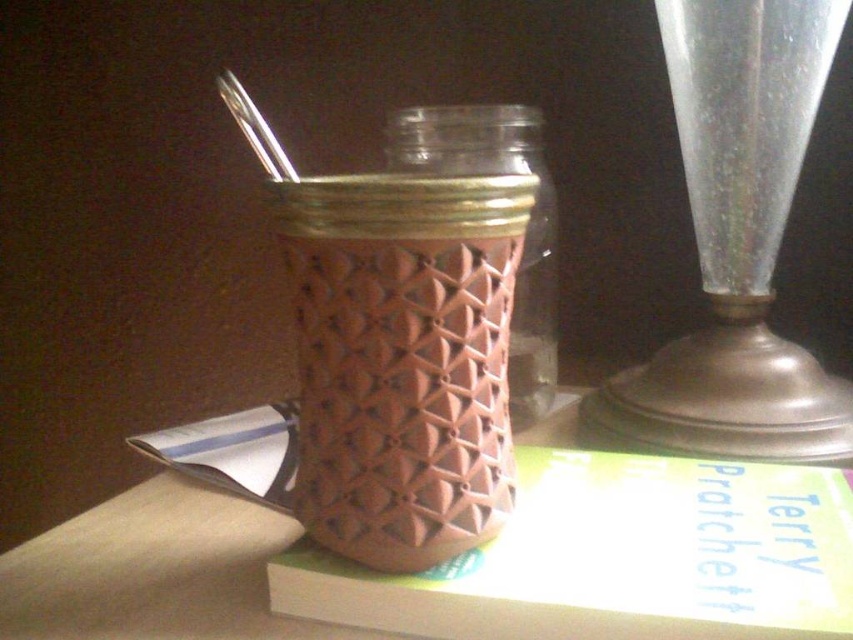
Can you confirm if transparent glass vase at right is positioned above brown textured vase at center?

Yes.

Does point (776, 236) come closer to viewer compared to point (42, 616)?

No, (776, 236) is further to viewer.

Is point (718, 371) farther from viewer compared to point (115, 508)?

That is True.

At what (x,y) coordinates should I click in order to perform the action: click on transparent glass vase at right. Please return your answer as a coordinate pair (x, y). Looking at the image, I should click on (735, 243).

Who is positioned more to the right, transparent glass vase at right or pink textured glass jar at center?

transparent glass vase at right

The image size is (853, 640). What do you see at coordinates (735, 243) in the screenshot?
I see `transparent glass vase at right` at bounding box center [735, 243].

The height and width of the screenshot is (640, 853). Identify the location of transparent glass vase at right. (735, 243).

Can you confirm if brown textured vase at center is positioned below pink textured glass jar at center?

Indeed, brown textured vase at center is positioned under pink textured glass jar at center.

Is brown textured vase at center closer to camera compared to pink textured glass jar at center?

Yes.

Does point (45, 628) lie behind point (498, 170)?

No, (45, 628) is closer to viewer.

The width and height of the screenshot is (853, 640). I want to click on brown textured vase at center, so click(x=142, y=568).